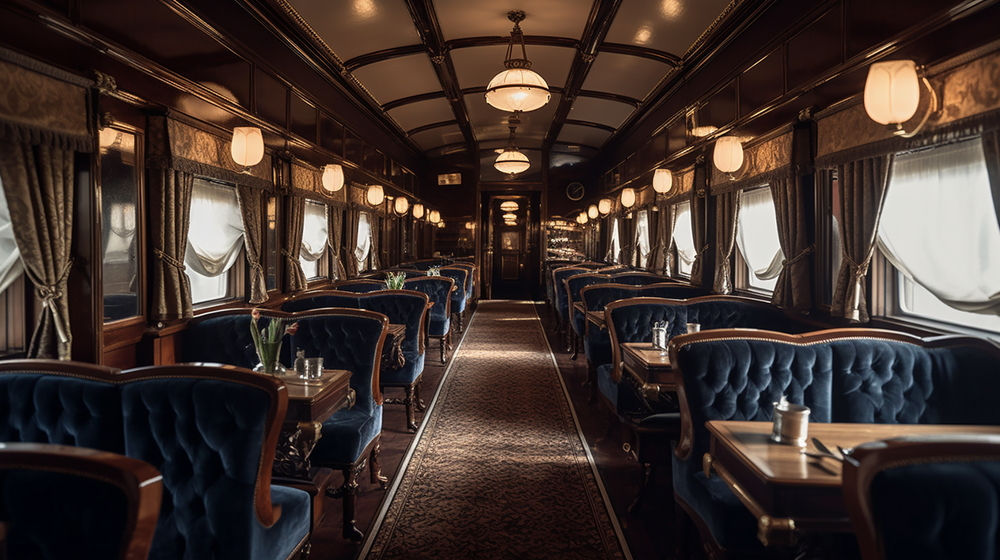
Find the location of a particular element. The height and width of the screenshot is (560, 1000). table is located at coordinates (760, 457), (643, 354), (592, 312), (399, 338), (311, 401), (429, 303).